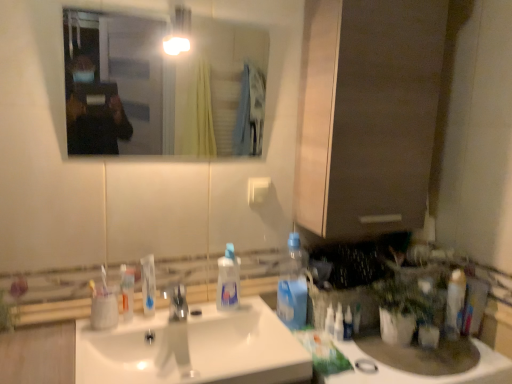
Where is `free space in front of translucent plastic mouthwash at sink`? free space in front of translucent plastic mouthwash at sink is located at coordinates (111, 338).